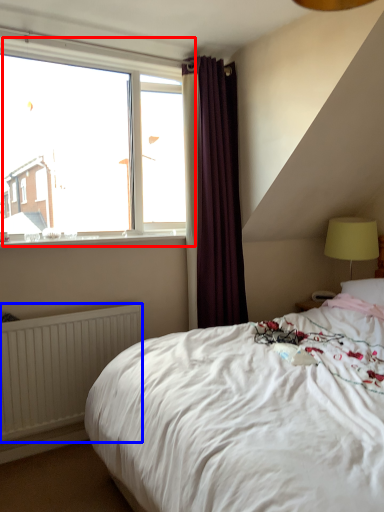
Question: Which object appears farthest to the camera in this image, window (highlighted by a red box) or radiator (highlighted by a blue box)?

Choices:
 (A) window
 (B) radiator

Answer: (A)